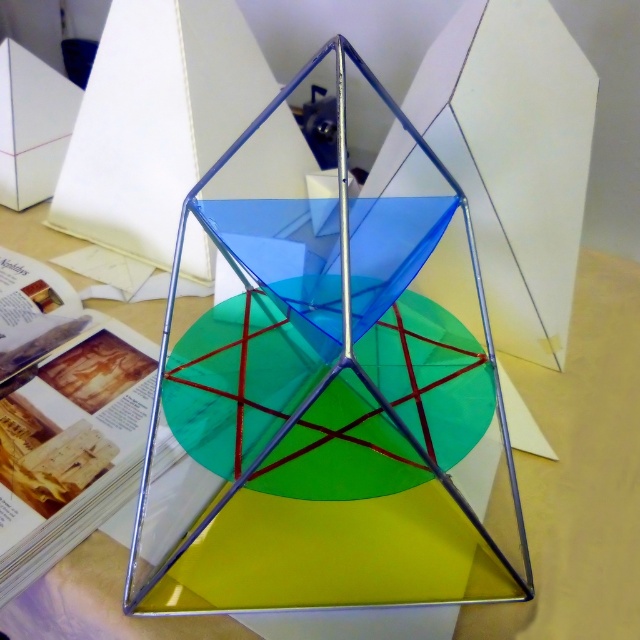
Question: Which point appears farthest from the camera in this image?

Choices:
 (A) (404, 264)
 (B) (577, 531)

Answer: (B)

Question: Which point appears closest to the camera in this image?

Choices:
 (A) click(602, 540)
 (B) click(198, 364)

Answer: (B)

Question: Which object appears farthest from the camera in this image?

Choices:
 (A) transparent glass table at center
 (B) transparent glass cube at center

Answer: (A)

Question: Is transparent glass cube at center to the right of transparent glass table at center from the viewer's perspective?

Choices:
 (A) yes
 (B) no

Answer: (B)

Question: Can you confirm if transparent glass cube at center is thinner than transparent glass table at center?

Choices:
 (A) yes
 (B) no

Answer: (B)

Question: Is transparent glass cube at center further to the viewer compared to transparent glass table at center?

Choices:
 (A) no
 (B) yes

Answer: (A)